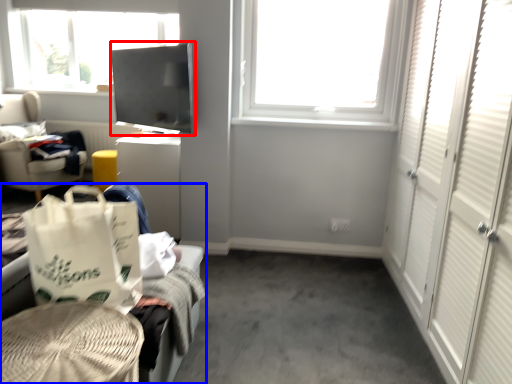
Question: Which object appears farthest to the camera in this image, window screen (highlighted by a red box) or furniture (highlighted by a blue box)?

Choices:
 (A) window screen
 (B) furniture

Answer: (A)